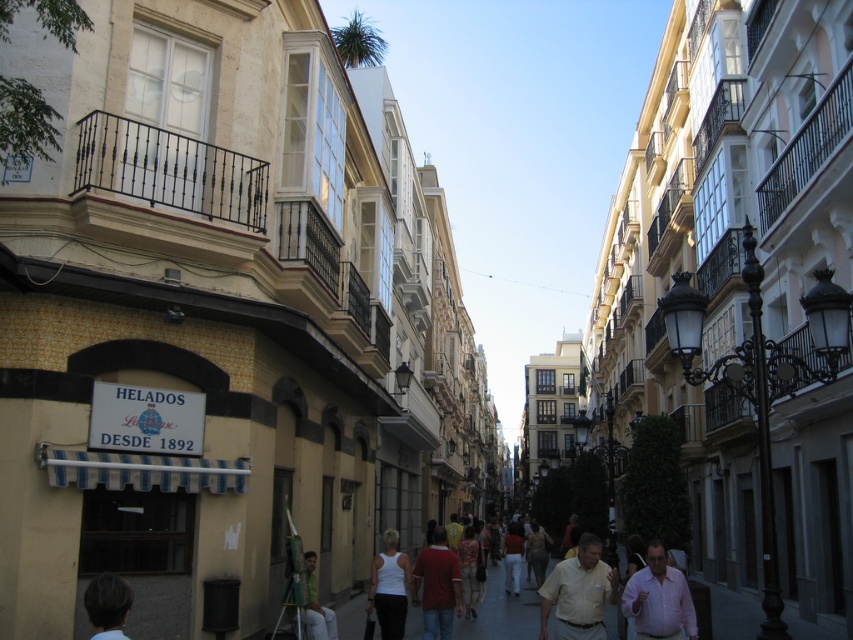
You are trying to decide which shirt to buy from the shop. Both the light brown shirt at center and the pink cotton shirt at center are on display. Which one is bigger?

The light brown shirt at center has a larger size compared to the pink cotton shirt at center, so the light brown shirt at center is bigger.

You are a tourist walking down this narrow street in Spain. You notice a white matte tank top at center and a light brown hair at lower left. Which object is closer to the bottom of the image?

The light brown hair at lower left is closer to the bottom of the image because it is positioned lower than the white matte tank top at center.

You are a tourist in this Spanish city and want to buy ice cream from the shop with the sign. You see a person wearing a light brown shirt at center and another person with light brown hair at lower left. Which person is closer to the ice cream shop sign?

The light brown shirt at center is bigger than the light brown hair at lower left, so the person with the light brown shirt at center is closer to the ice cream shop sign.